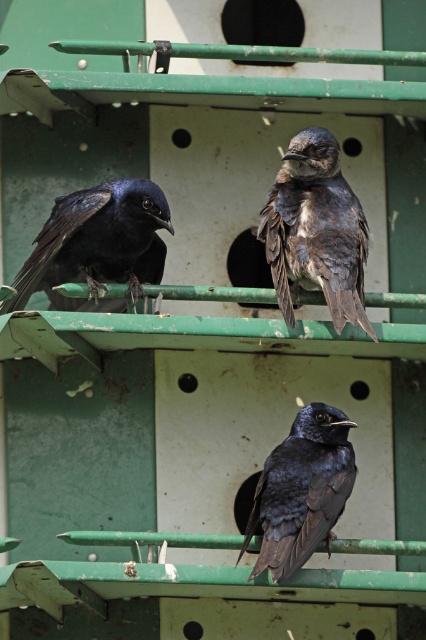
Consider the image. You are a bird trying to land on the birdhouse. You see two points on the birdhouse structure labeled as point (94, 301) and point (354, 476). Which point is closer to you as you approach the birdhouse?

Point (94, 301) is closer to you than point (354, 476) because it is further to the viewer.